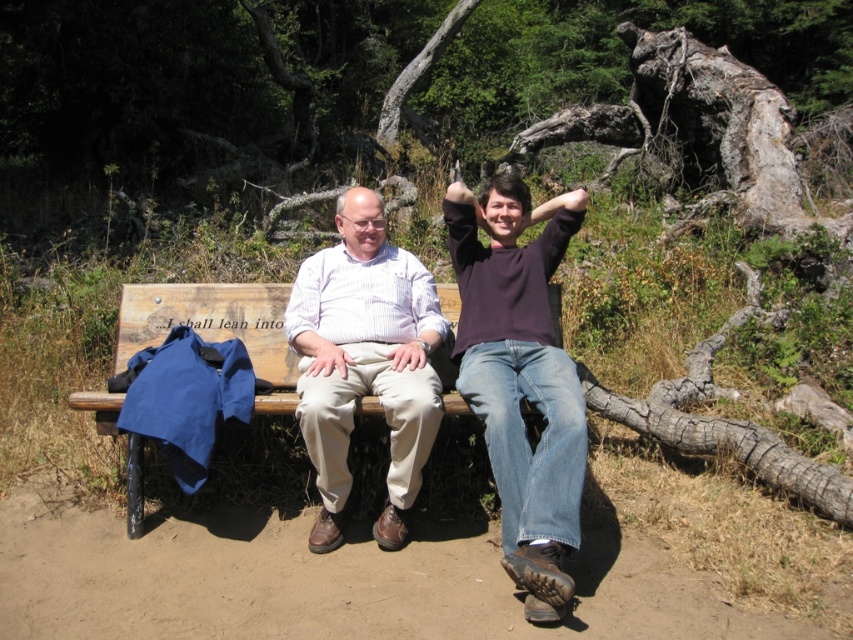
You are a photographer setting up a shot of the two people on the wooden bench. You want to ensure the matte brown shirt at center and the dark purple sweater at upper center are both clearly visible. Which clothing item should you focus on first to avoid blurring due to their positions?

The matte brown shirt at center is positioned under the dark purple sweater at upper center, so focusing on the dark purple sweater at upper center first would ensure it stays in frame and avoid blurring since it is higher up.